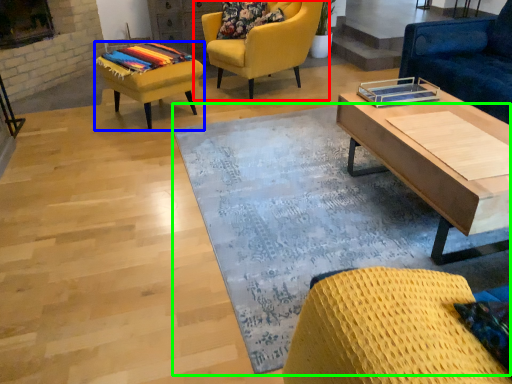
Question: Which is farther away from chair (highlighted by a red box)? stool (highlighted by a blue box) or mat (highlighted by a green box)?

Choices:
 (A) stool
 (B) mat

Answer: (B)